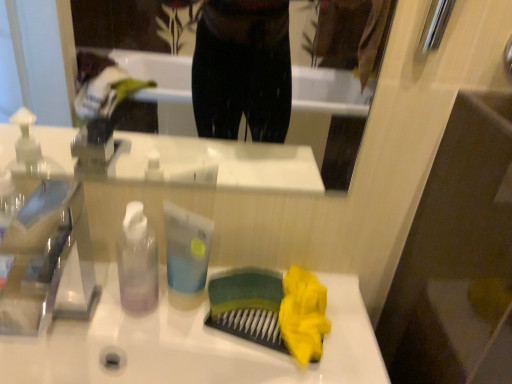
Question: Is translucent plastic bottle at center far from transparent plastic bottle at center?

Choices:
 (A) yes
 (B) no

Answer: (B)

Question: Is translucent plastic bottle at center bigger than transparent plastic bottle at center?

Choices:
 (A) no
 (B) yes

Answer: (A)

Question: Can we say translucent plastic bottle at center lies outside transparent plastic bottle at center?

Choices:
 (A) no
 (B) yes

Answer: (B)

Question: Can you confirm if translucent plastic bottle at center is wider than transparent plastic bottle at center?

Choices:
 (A) no
 (B) yes

Answer: (A)

Question: Is translucent plastic bottle at center closer to camera compared to transparent plastic bottle at center?

Choices:
 (A) no
 (B) yes

Answer: (A)

Question: Considering the relative sizes of translucent plastic bottle at center and transparent plastic bottle at center in the image provided, is translucent plastic bottle at center taller than transparent plastic bottle at center?

Choices:
 (A) no
 (B) yes

Answer: (A)

Question: From the image's perspective, is transparent plastic faucet at left over transparent plastic bottle at center?

Choices:
 (A) no
 (B) yes

Answer: (A)

Question: From a real-world perspective, is transparent plastic faucet at left under transparent plastic bottle at center?

Choices:
 (A) no
 (B) yes

Answer: (B)

Question: Is transparent plastic faucet at left positioned beyond the bounds of transparent plastic bottle at center?

Choices:
 (A) no
 (B) yes

Answer: (B)

Question: From a real-world perspective, does transparent plastic faucet at left stand above transparent plastic bottle at center?

Choices:
 (A) yes
 (B) no

Answer: (B)

Question: Does transparent plastic faucet at left have a lesser height compared to transparent plastic bottle at center?

Choices:
 (A) no
 (B) yes

Answer: (A)

Question: Is transparent plastic faucet at left closer to the viewer compared to transparent plastic bottle at center?

Choices:
 (A) yes
 (B) no

Answer: (A)

Question: Considering the relative sizes of translucent plastic bottle at center and transparent plastic faucet at left in the image provided, is translucent plastic bottle at center bigger than transparent plastic faucet at left?

Choices:
 (A) yes
 (B) no

Answer: (B)